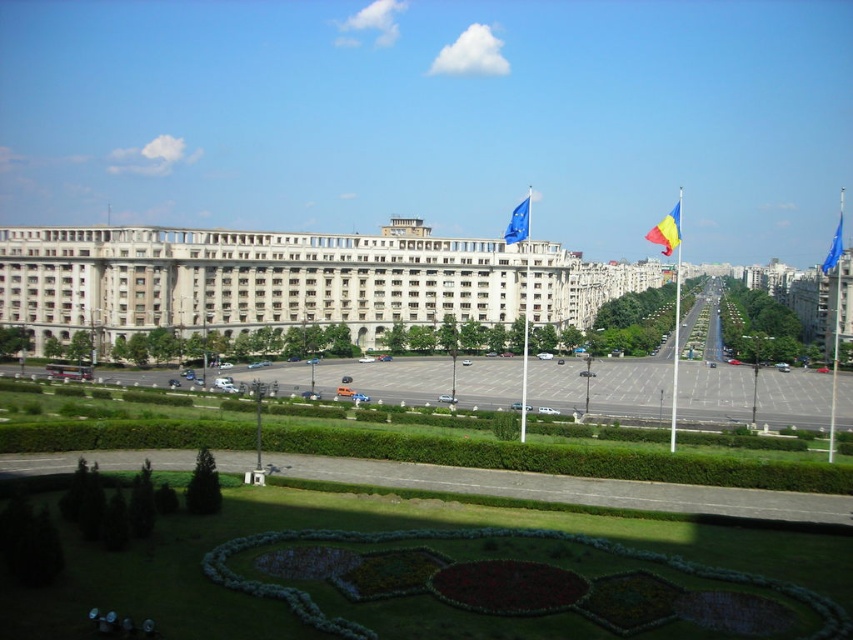
Question: Considering the real-world distances, which object is farthest from the blue fabric flag at center?

Choices:
 (A) blue fabric flag at right
 (B) yellow and blue fabric flag at upper right

Answer: (A)

Question: Estimate the real-world distances between objects in this image. Which object is farther from the blue fabric flag at center?

Choices:
 (A) white stone building at center
 (B) blue fabric flag at right

Answer: (B)

Question: Among these points, which one is nearest to the camera?

Choices:
 (A) (291, 262)
 (B) (515, 208)
 (C) (674, 241)

Answer: (C)

Question: Is white stone building at center below yellow and blue fabric flag at upper right?

Choices:
 (A) no
 (B) yes

Answer: (B)

Question: In this image, where is yellow and blue fabric flag at upper right located relative to blue fabric flag at center?

Choices:
 (A) left
 (B) right

Answer: (B)

Question: Is blue fabric flag at center to the left of blue fabric flag at right from the viewer's perspective?

Choices:
 (A) yes
 (B) no

Answer: (A)